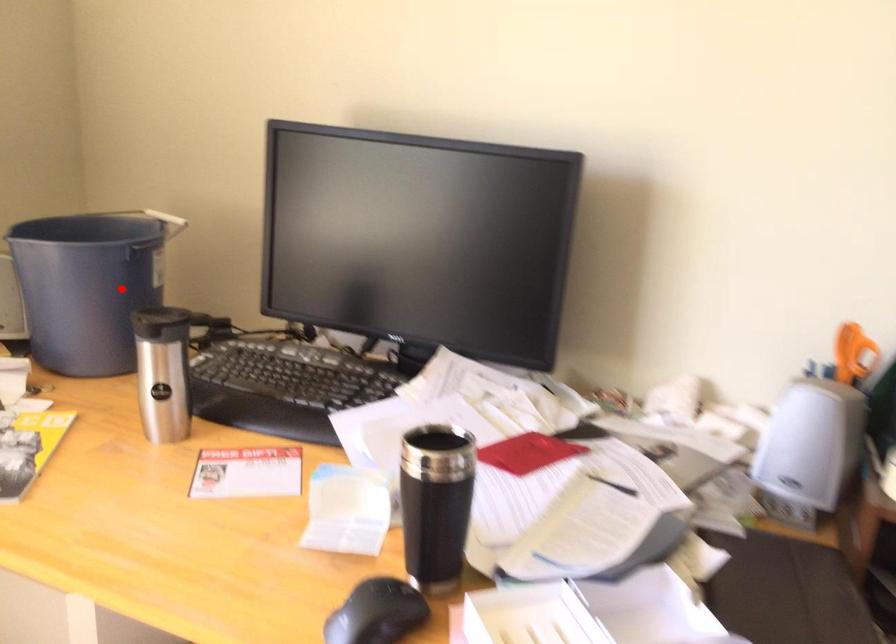
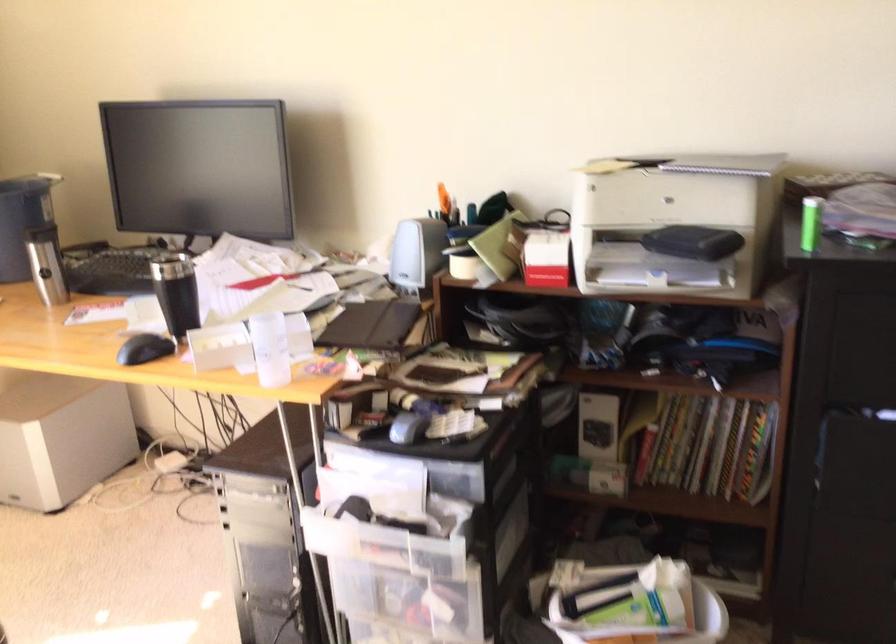
Locate, in the second image, the point that corresponds to the highlighted location in the first image.

(22, 220)